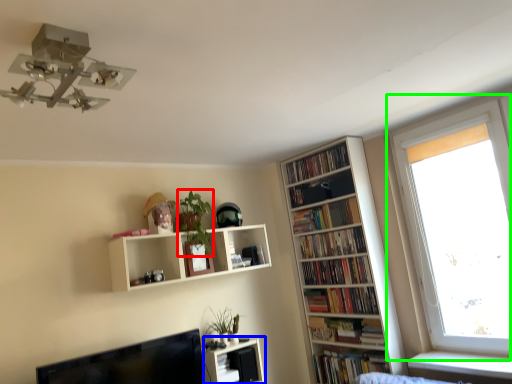
Question: Based on their relative distances, which object is nearer to plant (highlighted by a red box)? Choose from shelf (highlighted by a blue box) and window (highlighted by a green box).

Choices:
 (A) shelf
 (B) window

Answer: (A)